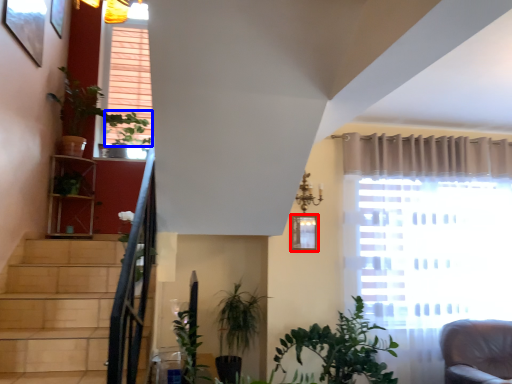
Question: Which of the following is the closest to the observer, picture frame (highlighted by a red box) or plant (highlighted by a blue box)?

Choices:
 (A) picture frame
 (B) plant

Answer: (A)